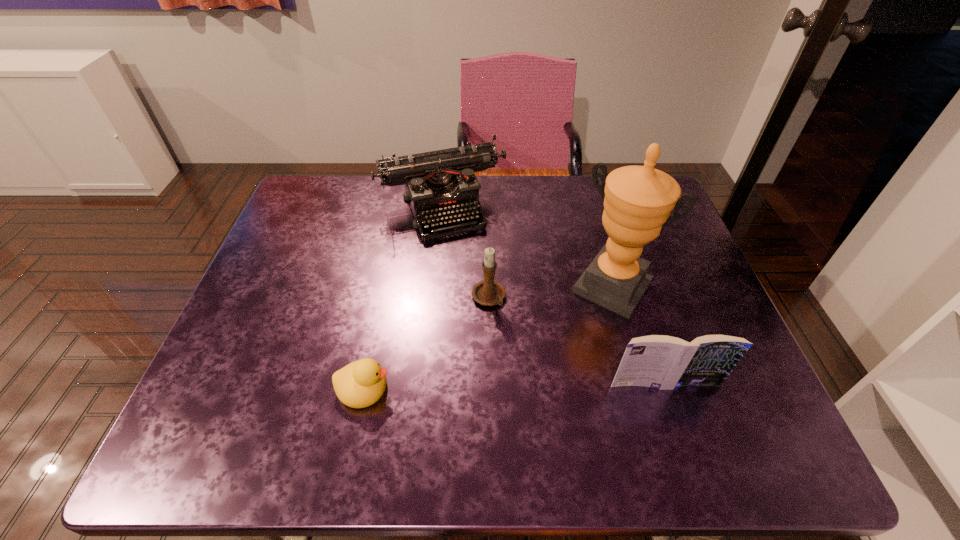
This screenshot has height=540, width=960. Identify the location of vacant space situated on the keyboard of the farthest object. (513, 350).

This screenshot has width=960, height=540. In order to click on vacant area situated 0.340m on the keyboard of the farthest object in this screenshot , I will do `click(506, 336)`.

At what (x,y) coordinates should I click in order to perform the action: click on vacant space situated on the side of the candle holder with the handle. Please return your answer as a coordinate pair (x, y). Looking at the image, I should click on (516, 357).

What are the coordinates of `vacant space located 0.160m on the side of the candle holder with the handle` in the screenshot? It's located at (521, 368).

The width and height of the screenshot is (960, 540). Find the location of `vacant area situated on the side of the candle holder with the handle`. vacant area situated on the side of the candle holder with the handle is located at coordinates (507, 339).

The image size is (960, 540). What are the coordinates of `object that is positioned at the far edge` in the screenshot? It's located at (438, 184).

Locate an element on the screen. The image size is (960, 540). duckling present at the near edge is located at coordinates (360, 384).

This screenshot has height=540, width=960. I want to click on book that is positioned at the near edge, so click(664, 362).

The image size is (960, 540). I want to click on book at the right edge, so click(x=664, y=362).

This screenshot has width=960, height=540. In order to click on award that is at the right edge in this screenshot , I will do `click(638, 200)`.